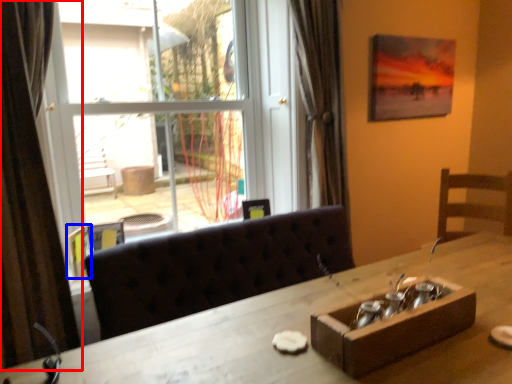
Question: Which point is closer to the camera, curtain (highlighted by a red box) or picture frame (highlighted by a blue box)?

Choices:
 (A) curtain
 (B) picture frame

Answer: (A)